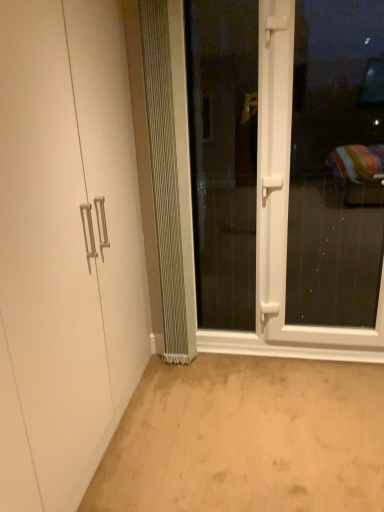
What do you see at coordinates (223, 157) in the screenshot?
I see `clear glass screen door at center, which is the 2th screen door in right-to-left order` at bounding box center [223, 157].

Describe the element at coordinates (66, 248) in the screenshot. I see `white matte cabinet at left` at that location.

Measure the distance between point (158,397) and camera.

The distance of point (158,397) from camera is 7.19 feet.

You are a GUI agent. You are given a task and a screenshot of the screen. Output one action in this format:
    pyautogui.click(x=<x>, y=<y>)
    Task: Click on the clear glass screen door at center, which is the 2th screen door in right-to-left order
    This screenshot has height=512, width=384.
    Given the screenshot: What is the action you would take?
    pyautogui.click(x=223, y=157)

Can you confirm if metallic silver radiator at center is bigger than beige carpet at lower center?

Incorrect, metallic silver radiator at center is not larger than beige carpet at lower center.

Between point (181, 60) and point (366, 453), which one is positioned in front?

Point (366, 453)

In the image, is metallic silver radiator at center positioned in front of or behind beige carpet at lower center?

metallic silver radiator at center is positioned farther from the viewer than beige carpet at lower center.

Does metallic silver radiator at center have a lesser height compared to beige carpet at lower center?

Incorrect, the height of metallic silver radiator at center does not fall short of that of beige carpet at lower center.

Which of these two, clear glass screen door at center, which ranks as the 1th screen door in left-to-right order, or beige carpet at lower center, is smaller?

clear glass screen door at center, which ranks as the 1th screen door in left-to-right order.

Considering the sizes of objects clear glass screen door at center, which is the 2th screen door in right-to-left order, and beige carpet at lower center in the image provided, who is thinner, clear glass screen door at center, which is the 2th screen door in right-to-left order, or beige carpet at lower center?

With smaller width is clear glass screen door at center, which is the 2th screen door in right-to-left order.

From the image's perspective, between clear glass screen door at center, which ranks as the 1th screen door in left-to-right order, and beige carpet at lower center, which one is located above?

From the image's view, clear glass screen door at center, which ranks as the 1th screen door in left-to-right order, is above.

Considering the positions of objects clear glass screen door at center, which ranks as the 1th screen door in left-to-right order, and beige carpet at lower center in the image provided, who is more to the left, clear glass screen door at center, which ranks as the 1th screen door in left-to-right order, or beige carpet at lower center?

clear glass screen door at center, which ranks as the 1th screen door in left-to-right order, is more to the left.

Is white matte cabinet at left far from metallic silver radiator at center?

That's not correct — white matte cabinet at left is a little close to metallic silver radiator at center.

Does white matte cabinet at left have a lesser width compared to metallic silver radiator at center?

No.

From the picture: Which is nearer, (x=68, y=303) or (x=176, y=205)?

Point (x=68, y=303).

Considering the relative sizes of metallic silver radiator at center and white matte cabinet at left in the image provided, is metallic silver radiator at center shorter than white matte cabinet at left?

Yes, metallic silver radiator at center is shorter than white matte cabinet at left.

From a real-world perspective, is metallic silver radiator at center positioned above or below white matte cabinet at left?

From a real-world perspective, metallic silver radiator at center is physically below white matte cabinet at left.

The width and height of the screenshot is (384, 512). What are the coordinates of `radiator below the white matte cabinet at left (from a real-world perspective)` in the screenshot? It's located at (170, 170).

Which of these two, beige carpet at lower center or white plastic screen door at center, which is the first screen door from right to left, stands taller?

white plastic screen door at center, which is the first screen door from right to left.

Considering the sizes of beige carpet at lower center and white plastic screen door at center, the 2th screen door from the left, in the image, is beige carpet at lower center wider or thinner than white plastic screen door at center, the 2th screen door from the left,?

Considering their sizes, beige carpet at lower center looks broader than white plastic screen door at center, the 2th screen door from the left.

Are beige carpet at lower center and white plastic screen door at center, the 2th screen door from the left, located far from each other?

No, beige carpet at lower center is in close proximity to white plastic screen door at center, the 2th screen door from the left.

Based on the photo, from the image's perspective, which one is positioned higher, beige carpet at lower center or white plastic screen door at center, the 2th screen door from the left?

From the image's view, white plastic screen door at center, the 2th screen door from the left, is above.

Which is behind, metallic silver radiator at center or white plastic screen door at center, the 2th screen door from the left?

metallic silver radiator at center.

From the image's perspective, which is above, metallic silver radiator at center or white plastic screen door at center, the 2th screen door from the left?

From the image's view, metallic silver radiator at center is above.

Is metallic silver radiator at center facing towards white plastic screen door at center, which is the first screen door from right to left?

No, metallic silver radiator at center is not aimed at white plastic screen door at center, which is the first screen door from right to left.

Is metallic silver radiator at center not inside white plastic screen door at center, the 2th screen door from the left?

Absolutely, metallic silver radiator at center is external to white plastic screen door at center, the 2th screen door from the left.

Do you think white matte cabinet at left is within beige carpet at lower center, or outside of it?

white matte cabinet at left is located beyond the bounds of beige carpet at lower center.

Does point (29, 114) come behind point (214, 406)?

No, (29, 114) is closer to viewer.

Between white matte cabinet at left and beige carpet at lower center, which one has less height?

beige carpet at lower center is shorter.

Where is `plain on the right side of metallic silver radiator at center`? The width and height of the screenshot is (384, 512). plain on the right side of metallic silver radiator at center is located at coordinates (x=247, y=438).

There is a beige carpet at lower center. Identify the location of the 2nd screen door above it (from a real-world perspective). (223, 157).

Looking at the image, which one is located closer to white plastic screen door at center, the 2th screen door from the left, clear glass screen door at center, which is the 2th screen door in right-to-left order, or beige carpet at lower center?

Based on the image, clear glass screen door at center, which is the 2th screen door in right-to-left order, appears to be nearer to white plastic screen door at center, the 2th screen door from the left.

Considering their positions, is white matte cabinet at left positioned further to clear glass screen door at center, which ranks as the 1th screen door in left-to-right order, than beige carpet at lower center?

white matte cabinet at left is further to clear glass screen door at center, which ranks as the 1th screen door in left-to-right order.

From the image, which object appears to be farther from clear glass screen door at center, which is the 2th screen door in right-to-left order, white matte cabinet at left or white plastic screen door at center, which is the first screen door from right to left?

Among the two, white matte cabinet at left is located further to clear glass screen door at center, which is the 2th screen door in right-to-left order.

Estimate the real-world distances between objects in this image. Which object is closer to metallic silver radiator at center, white matte cabinet at left or clear glass screen door at center, which is the 2th screen door in right-to-left order?

clear glass screen door at center, which is the 2th screen door in right-to-left order.

Which object lies further to the anchor point white plastic screen door at center, which is the first screen door from right to left, white matte cabinet at left or clear glass screen door at center, which ranks as the 1th screen door in left-to-right order?

The object further to white plastic screen door at center, which is the first screen door from right to left, is white matte cabinet at left.

When comparing their distances from beige carpet at lower center, does white plastic screen door at center, which is the first screen door from right to left, or metallic silver radiator at center seem closer?

metallic silver radiator at center.

Considering their positions, is white matte cabinet at left positioned further to beige carpet at lower center than white plastic screen door at center, which is the first screen door from right to left?

white plastic screen door at center, which is the first screen door from right to left, is further to beige carpet at lower center.

Which object lies nearer to the anchor point clear glass screen door at center, which is the 2th screen door in right-to-left order, white plastic screen door at center, the 2th screen door from the left, or white matte cabinet at left?

Based on the image, white plastic screen door at center, the 2th screen door from the left, appears to be nearer to clear glass screen door at center, which is the 2th screen door in right-to-left order.

Identify the location of radiator between clear glass screen door at center, which is the 2th screen door in right-to-left order, and beige carpet at lower center from top to bottom. (170, 170).

Where is `plain between white matte cabinet at left and white plastic screen door at center, which is the first screen door from right to left`? The width and height of the screenshot is (384, 512). plain between white matte cabinet at left and white plastic screen door at center, which is the first screen door from right to left is located at coordinates (247, 438).

Locate an element on the screen. screen door located between metallic silver radiator at center and white plastic screen door at center, the 2th screen door from the left, in the left-right direction is located at coordinates (223, 157).

At what (x,y) coordinates should I click in order to perform the action: click on screen door positioned between white matte cabinet at left and clear glass screen door at center, which ranks as the 1th screen door in left-to-right order, from near to far. Please return your answer as a coordinate pair (x, y). Looking at the image, I should click on pyautogui.click(x=287, y=172).